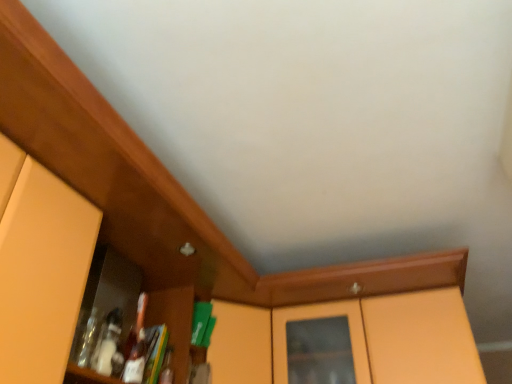
Question: Is matte orange cabinet at left surrounding matte orange cabinet at left?

Choices:
 (A) yes
 (B) no

Answer: (B)

Question: Can you confirm if matte orange cabinet at left is wider than matte orange cabinet at left?

Choices:
 (A) yes
 (B) no

Answer: (A)

Question: Is matte orange cabinet at left looking in the opposite direction of matte orange cabinet at left?

Choices:
 (A) yes
 (B) no

Answer: (B)

Question: From a real-world perspective, is matte orange cabinet at left on top of matte orange cabinet at left?

Choices:
 (A) yes
 (B) no

Answer: (A)

Question: Is matte orange cabinet at left far away from matte orange cabinet at left?

Choices:
 (A) no
 (B) yes

Answer: (A)

Question: Can you confirm if matte orange cabinet at left is taller than matte orange cabinet at left?

Choices:
 (A) yes
 (B) no

Answer: (B)

Question: Is matte orange cabinet at center closer to the viewer compared to matte orange cabinet at left?

Choices:
 (A) no
 (B) yes

Answer: (A)

Question: Can you confirm if matte orange cabinet at center is bigger than matte orange cabinet at left?

Choices:
 (A) yes
 (B) no

Answer: (A)

Question: Can you confirm if matte orange cabinet at center is wider than matte orange cabinet at left?

Choices:
 (A) yes
 (B) no

Answer: (A)

Question: Is matte orange cabinet at center thinner than matte orange cabinet at left?

Choices:
 (A) yes
 (B) no

Answer: (B)

Question: From a real-world perspective, is matte orange cabinet at center over matte orange cabinet at left?

Choices:
 (A) no
 (B) yes

Answer: (B)

Question: Could you tell me if matte orange cabinet at center is turned towards matte orange cabinet at left?

Choices:
 (A) no
 (B) yes

Answer: (A)

Question: From a real-world perspective, is matte orange cabinet at left physically below matte orange cabinet at center?

Choices:
 (A) yes
 (B) no

Answer: (A)